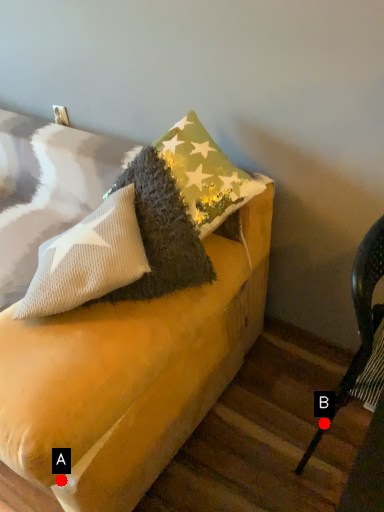
Question: Two points are circled on the image, labeled by A and B beside each circle. Among these points, which one is nearest to the camera?

Choices:
 (A) A is closer
 (B) B is closer

Answer: (A)